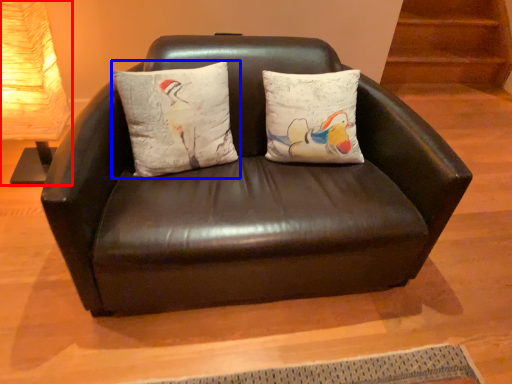
Question: Among these objects, which one is farthest to the camera, table lamp (highlighted by a red box) or pillow (highlighted by a blue box)?

Choices:
 (A) table lamp
 (B) pillow

Answer: (A)